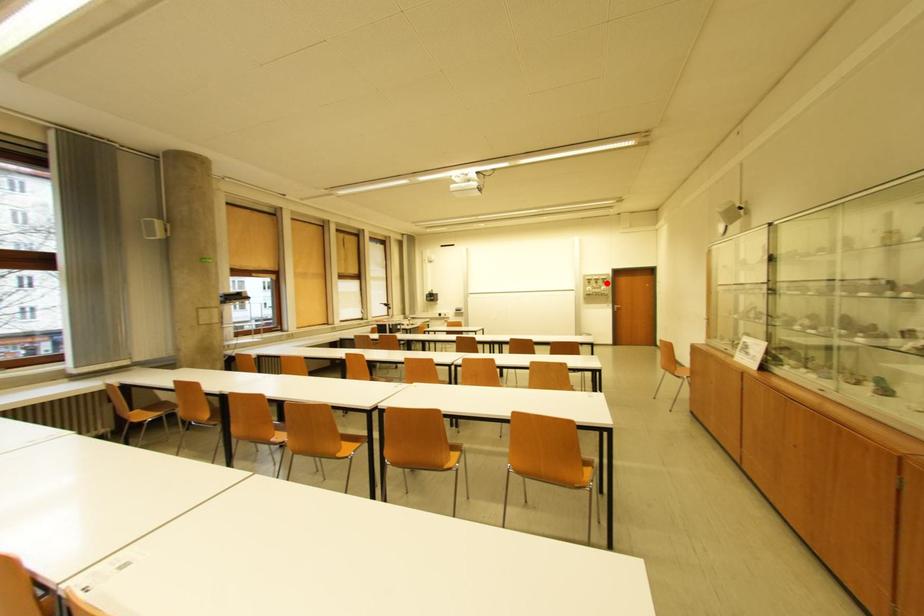
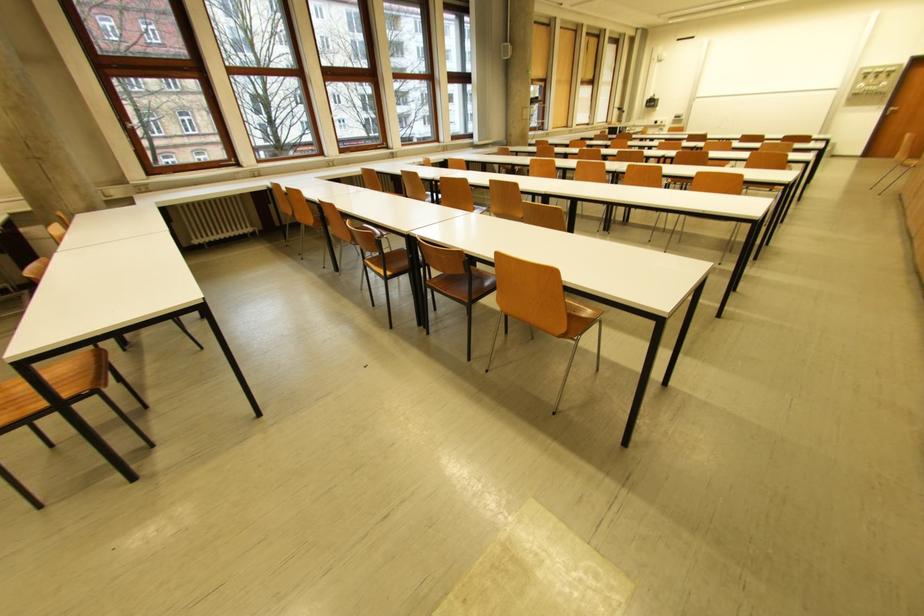
In the second image, find the point that corresponds to the highlighted location in the first image.

(890, 77)